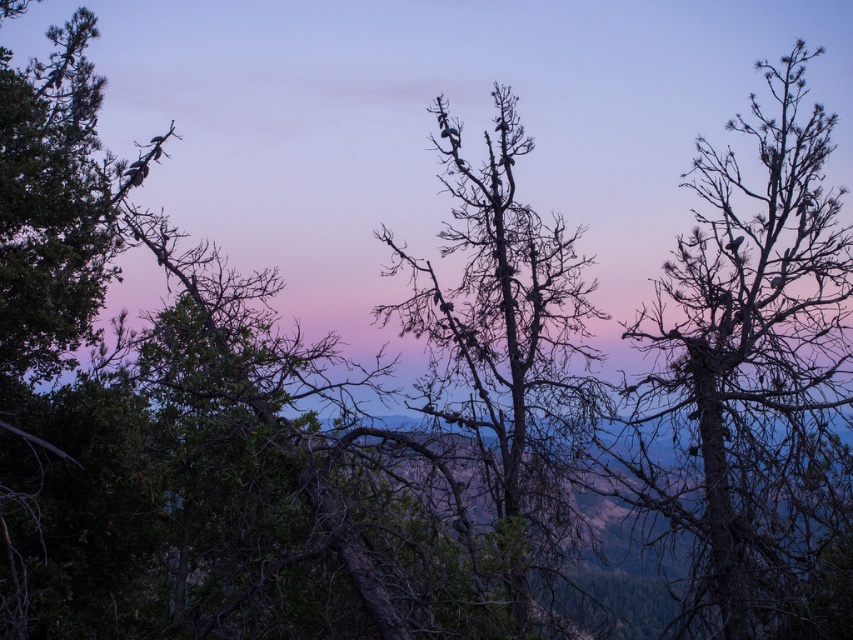
Question: Can you confirm if dark brown bark tree at right is wider than brown/dry wood tree at center?

Choices:
 (A) no
 (B) yes

Answer: (B)

Question: Does dark brown bark tree at right have a greater width compared to brown/dry wood tree at center?

Choices:
 (A) no
 (B) yes

Answer: (B)

Question: Which of the following is the farthest from the observer?

Choices:
 (A) dark brown bark tree at right
 (B) brown/dry wood tree at center

Answer: (B)

Question: Is the position of dark brown bark tree at right less distant than that of brown/dry wood tree at center?

Choices:
 (A) yes
 (B) no

Answer: (A)